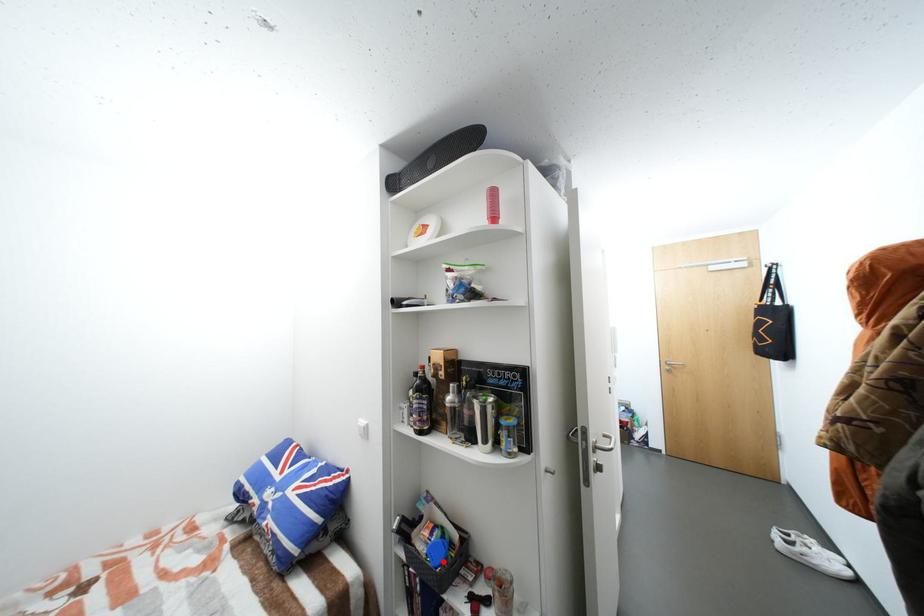
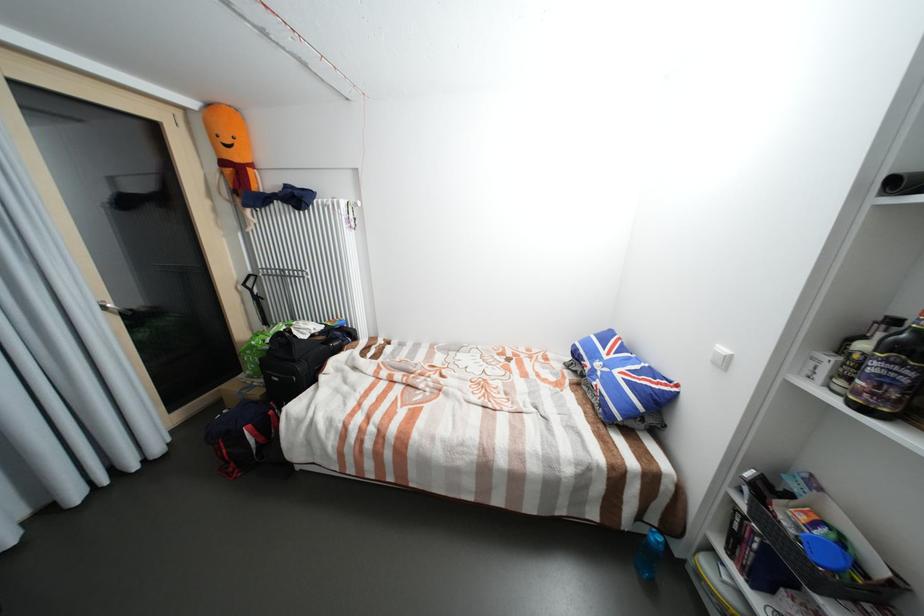
Find the pixel in the second image that matches the highlighted location in the first image.

(828, 560)